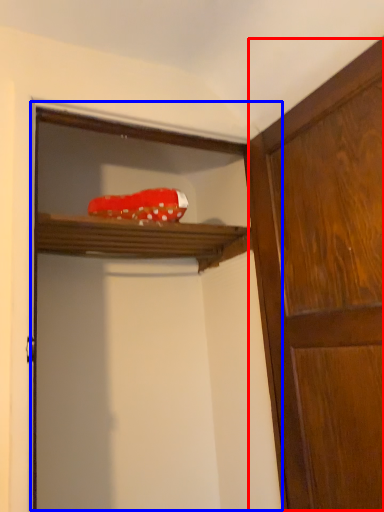
Question: Which point is further to the camera, cabinetry (highlighted by a red box) or screen door (highlighted by a blue box)?

Choices:
 (A) cabinetry
 (B) screen door

Answer: (B)